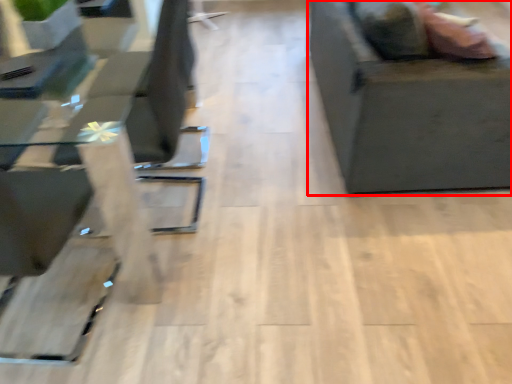
Question: In this image, where is furniture (annotated by the red box) located relative to table?

Choices:
 (A) right
 (B) left

Answer: (A)